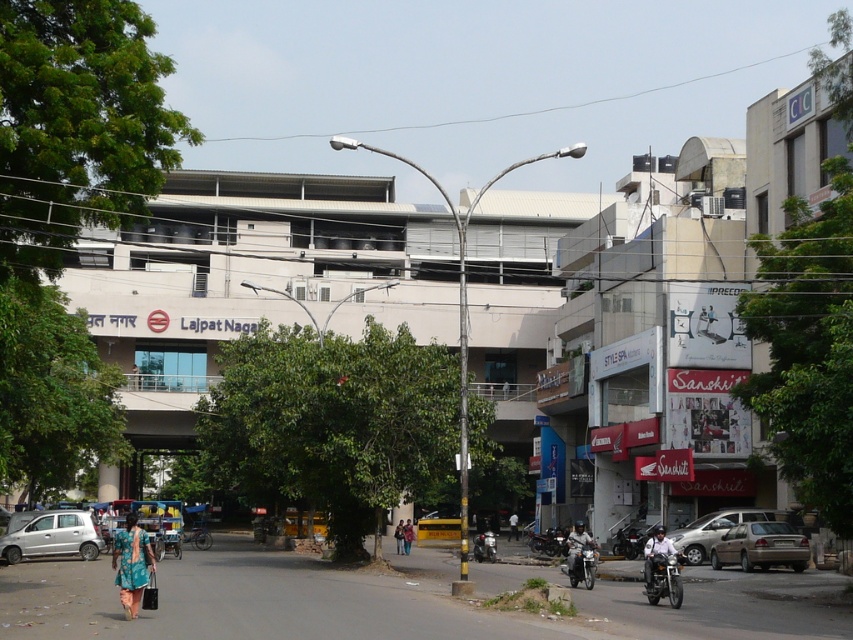
Does metallic silver motorcycle at lower right have a lesser width compared to green fabric dress at center?

Correct, metallic silver motorcycle at lower right's width is less than green fabric dress at center's.

Is metallic silver motorcycle at lower right further to the viewer compared to green fabric dress at center?

No, metallic silver motorcycle at lower right is closer to the viewer.

Does point (570, 563) come farther from viewer compared to point (402, 552)?

No, (570, 563) is in front of (402, 552).

Locate an element on the screen. metallic silver motorcycle at lower right is located at coordinates (579, 561).

Does metallic silver car at lower right appear on the right side of white matte helmet at lower right?

Indeed, metallic silver car at lower right is positioned on the right side of white matte helmet at lower right.

Can you confirm if metallic silver car at lower right is bigger than white matte helmet at lower right?

No.

Describe the element at coordinates (759, 547) in the screenshot. I see `metallic silver car at lower right` at that location.

This screenshot has width=853, height=640. Find the location of `metallic silver car at lower right`. metallic silver car at lower right is located at coordinates (759, 547).

Does metallic silver helmet at center have a larger size compared to green fabric dress at center?

Correct, metallic silver helmet at center is larger in size than green fabric dress at center.

From the picture: Does metallic silver helmet at center have a smaller size compared to green fabric dress at center?

Actually, metallic silver helmet at center might be larger than green fabric dress at center.

The image size is (853, 640). Describe the element at coordinates (577, 545) in the screenshot. I see `metallic silver helmet at center` at that location.

Image resolution: width=853 pixels, height=640 pixels. In order to click on metallic silver helmet at center in this screenshot , I will do `click(577, 545)`.